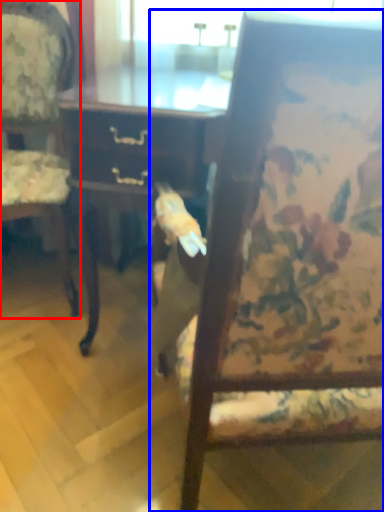
Question: Which object appears farthest to the camera in this image, chair (highlighted by a red box) or chair (highlighted by a blue box)?

Choices:
 (A) chair
 (B) chair

Answer: (A)